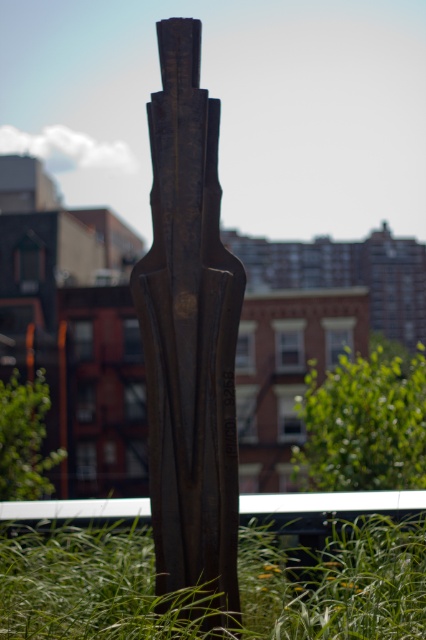
Between green leafy plant at center and green grass at lower left, which one is positioned higher?

green leafy plant at center

Who is more forward, (379, 444) or (8, 390)?

Positioned in front is point (379, 444).

Which is in front, point (310, 410) or point (11, 444)?

Point (310, 410) is more forward.

Find the location of a particular element. This screenshot has width=426, height=640. green leafy plant at center is located at coordinates (363, 424).

Who is positioned more to the right, green grass at center or green leafy plant at center?

From the viewer's perspective, green leafy plant at center appears more on the right side.

Between point (347, 634) and point (308, 449), which one is positioned behind?

The point (308, 449) is more distant.

Where is `green grass at center`? green grass at center is located at coordinates (334, 582).

Measure the distance between rusty metal sculpture at center and green grass at lower left.

rusty metal sculpture at center and green grass at lower left are 6.48 meters apart from each other.

Does rusty metal sculpture at center have a larger size compared to green grass at lower left?

Correct, rusty metal sculpture at center is larger in size than green grass at lower left.

Which is behind, point (213, 490) or point (46, 384)?

Point (46, 384)

Where is `rusty metal sculpture at center`? rusty metal sculpture at center is located at coordinates (189, 333).